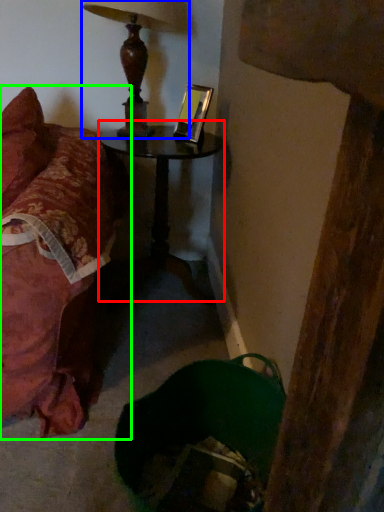
Question: Estimate the real-world distances between objects in this image. Which object is farther from table (highlighted by a red box), lamp (highlighted by a blue box) or furniture (highlighted by a green box)?

Choices:
 (A) lamp
 (B) furniture

Answer: (B)